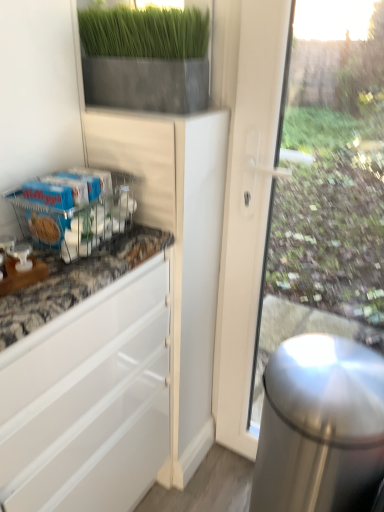
Question: Does polished stainless steel trash can at right have a larger size compared to matte gray planter at upper center?

Choices:
 (A) yes
 (B) no

Answer: (A)

Question: Is polished stainless steel trash can at right placed right next to matte gray planter at upper center?

Choices:
 (A) no
 (B) yes

Answer: (A)

Question: Is polished stainless steel trash can at right further to camera compared to matte gray planter at upper center?

Choices:
 (A) yes
 (B) no

Answer: (B)

Question: Is polished stainless steel trash can at right oriented towards matte gray planter at upper center?

Choices:
 (A) yes
 (B) no

Answer: (B)

Question: From the image's perspective, is polished stainless steel trash can at right over matte gray planter at upper center?

Choices:
 (A) no
 (B) yes

Answer: (A)

Question: Considering the relative sizes of polished stainless steel trash can at right and matte gray planter at upper center in the image provided, is polished stainless steel trash can at right smaller than matte gray planter at upper center?

Choices:
 (A) yes
 (B) no

Answer: (B)

Question: Could you tell me if metallic wire rack at lower left is turned towards matte gray planter at upper center?

Choices:
 (A) yes
 (B) no

Answer: (B)

Question: Considering the relative positions of metallic wire rack at lower left and matte gray planter at upper center in the image provided, is metallic wire rack at lower left in front of matte gray planter at upper center?

Choices:
 (A) yes
 (B) no

Answer: (A)

Question: Considering the relative sizes of metallic wire rack at lower left and matte gray planter at upper center in the image provided, is metallic wire rack at lower left thinner than matte gray planter at upper center?

Choices:
 (A) no
 (B) yes

Answer: (A)

Question: Can you confirm if metallic wire rack at lower left is taller than matte gray planter at upper center?

Choices:
 (A) no
 (B) yes

Answer: (A)

Question: Is metallic wire rack at lower left looking in the opposite direction of matte gray planter at upper center?

Choices:
 (A) no
 (B) yes

Answer: (A)

Question: Does metallic wire rack at lower left appear on the left side of matte gray planter at upper center?

Choices:
 (A) no
 (B) yes

Answer: (B)

Question: From a real-world perspective, is metallic wire rack at lower left located higher than polished stainless steel trash can at right?

Choices:
 (A) yes
 (B) no

Answer: (A)